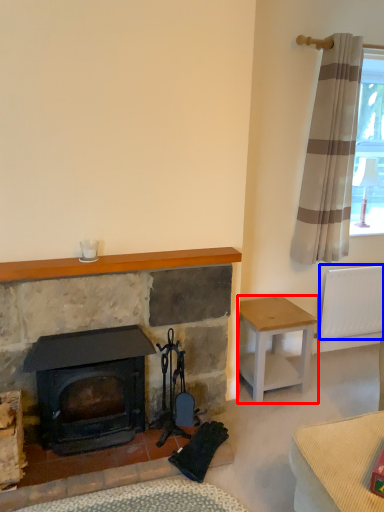
Question: Among these objects, which one is nearest to the camera, stool (highlighted by a red box) or radiator (highlighted by a blue box)?

Choices:
 (A) stool
 (B) radiator

Answer: (A)